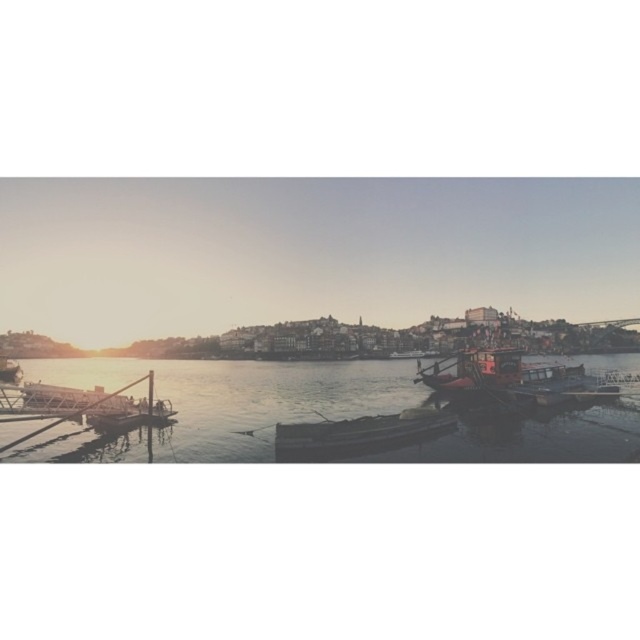
Question: From the image, what is the correct spatial relationship of clear water at lower left in relation to wooden boat at right?

Choices:
 (A) right
 (B) left

Answer: (B)

Question: Which point is farther to the camera?

Choices:
 (A) metallic dock at lower left
 (B) clear water at lower left
 (C) wooden boat at center
 (D) wooden boat at right

Answer: (D)

Question: Based on their relative distances, which object is nearer to the clear water at lower left?

Choices:
 (A) metallic dock at lower left
 (B) wooden boat at right

Answer: (A)

Question: Considering the real-world distances, which object is closest to the wooden boat at right?

Choices:
 (A) metallic dock at lower left
 (B) clear water at lower left

Answer: (B)

Question: Can you confirm if clear water at lower left is positioned to the right of wooden boat at right?

Choices:
 (A) yes
 (B) no

Answer: (B)

Question: Does clear water at lower left have a greater width compared to wooden boat at center?

Choices:
 (A) no
 (B) yes

Answer: (B)